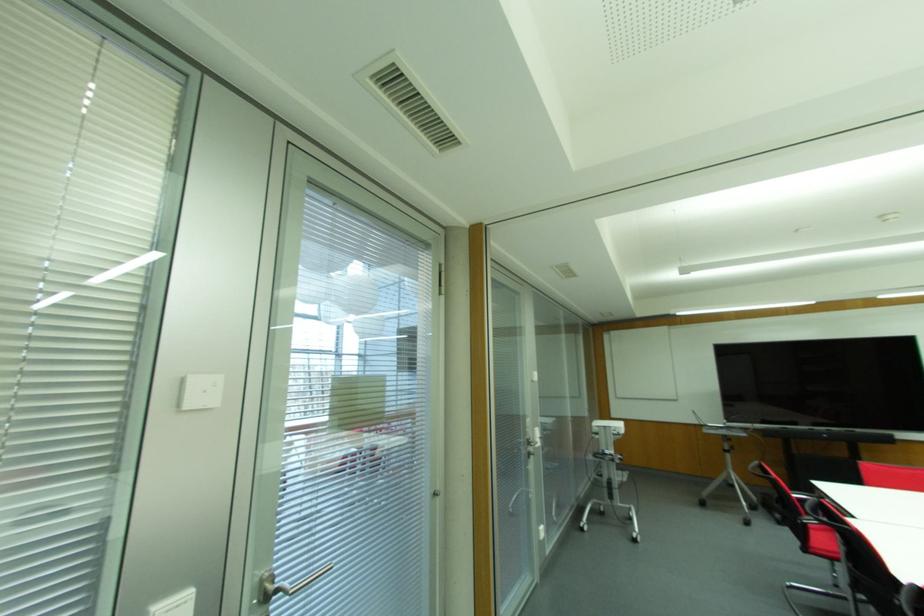
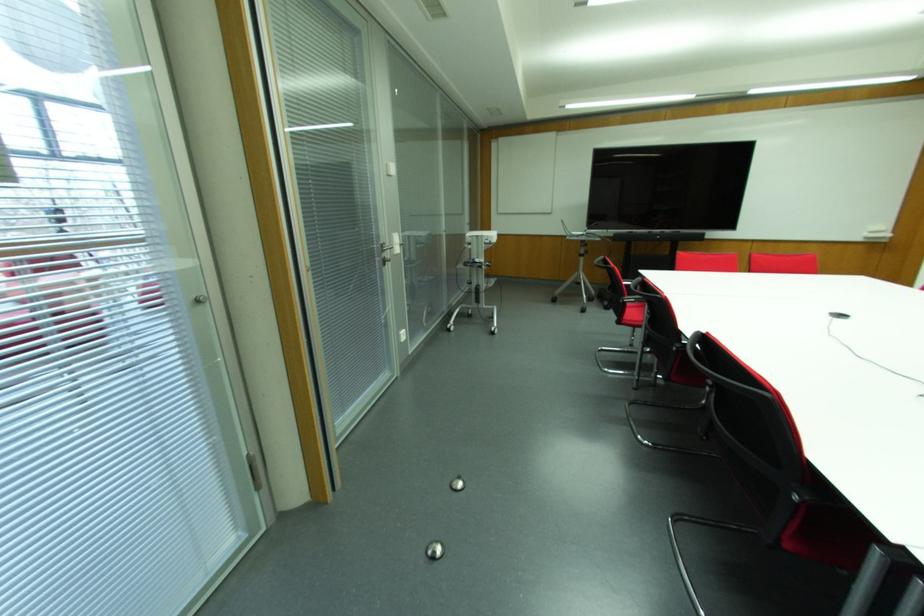
Based on the continuous images, in which direction is the camera rotating?

The rotation direction of the camera is right-down.